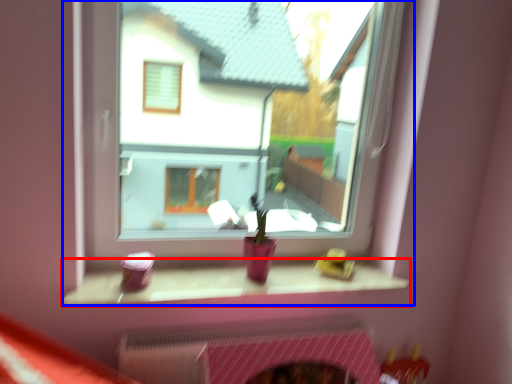
Question: Which point is closer to the camera, window sill (highlighted by a red box) or window (highlighted by a blue box)?

Choices:
 (A) window sill
 (B) window

Answer: (B)